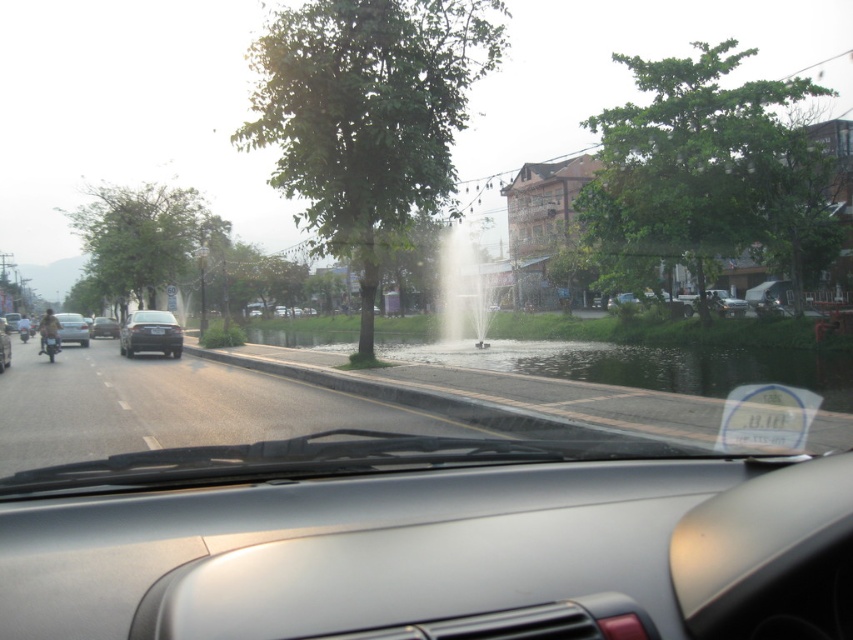
Question: From the image, what is the correct spatial relationship of black matte car at center in relation to metallic silver motorcycle at left?

Choices:
 (A) left
 (B) right

Answer: (B)

Question: Which is farther from the black matte car at center?

Choices:
 (A) black plastic license plate at center
 (B) matte black car at left
 (C) metallic silver motorcycle at left
 (D) matte black sedan at left

Answer: (B)

Question: From the image, what is the correct spatial relationship of black matte car at center in relation to matte black car at left?

Choices:
 (A) above
 (B) below

Answer: (A)

Question: Is black matte car at center wider than matte black car at left?

Choices:
 (A) yes
 (B) no

Answer: (B)

Question: Which of the following is the closest to the observer?

Choices:
 (A) matte black sedan at left
 (B) black plastic license plate at center
 (C) matte black car at left
 (D) metallic silver motorcycle at left

Answer: (C)

Question: Which point is closer to the camera?

Choices:
 (A) (155, 346)
 (B) (102, 317)
 (C) (155, 326)

Answer: (A)